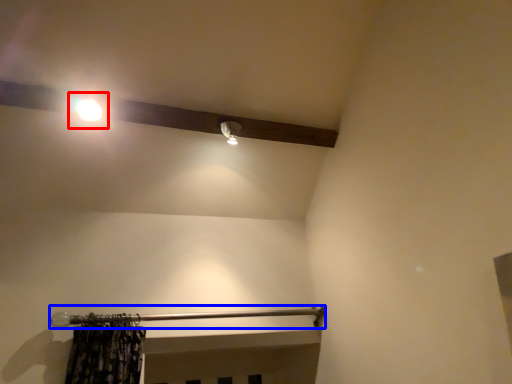
Question: Which object appears closest to the camera in this image, moonlight (highlighted by a red box) or rail (highlighted by a blue box)?

Choices:
 (A) moonlight
 (B) rail

Answer: (B)